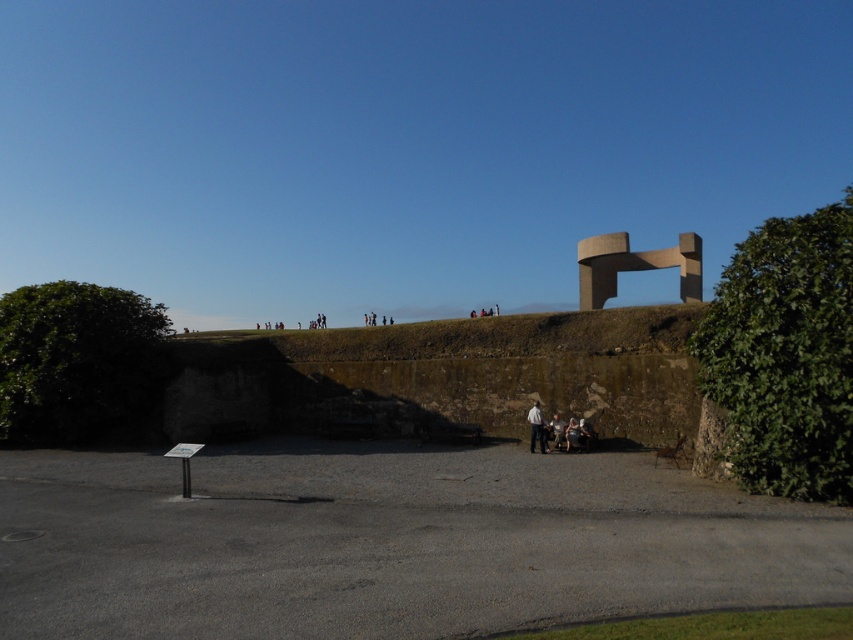
You are a photographer trying to capture the light gray fabric pants at center without the green leafy hedge at right blocking the view. Based on their positions, is this possible?

The green leafy hedge at right is located above the light gray fabric pants at center, so if you position yourself below the pants, you can avoid the hedge blocking the view.

You are a photographer trying to capture a wide shot of the light gray fabric pants at center and the green leafy hedge at right. Given that your camera can only focus on objects within a 3 meter width, will both objects fit in the frame?

The green leafy hedge at right is wider than the light gray fabric pants at center. Since the camera can focus on objects within a 3 meter width, but the total width of both objects combined may exceed the limit, it depends on their exact positions and distances. However, the description only states the hedge is wider, not the combined width. Without specific measurements, we can only confirm the hedge is wider, but cannot definitively answer if both fit together.